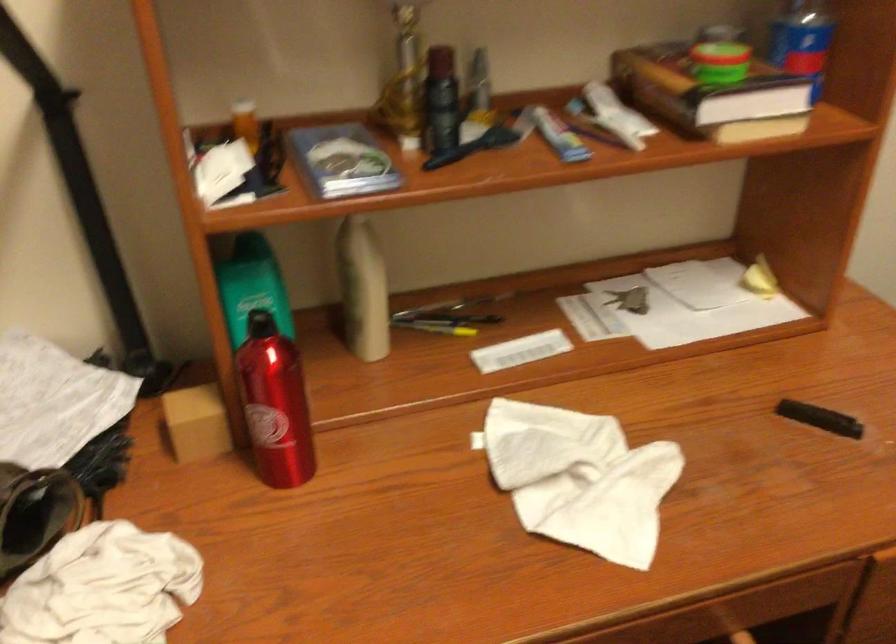
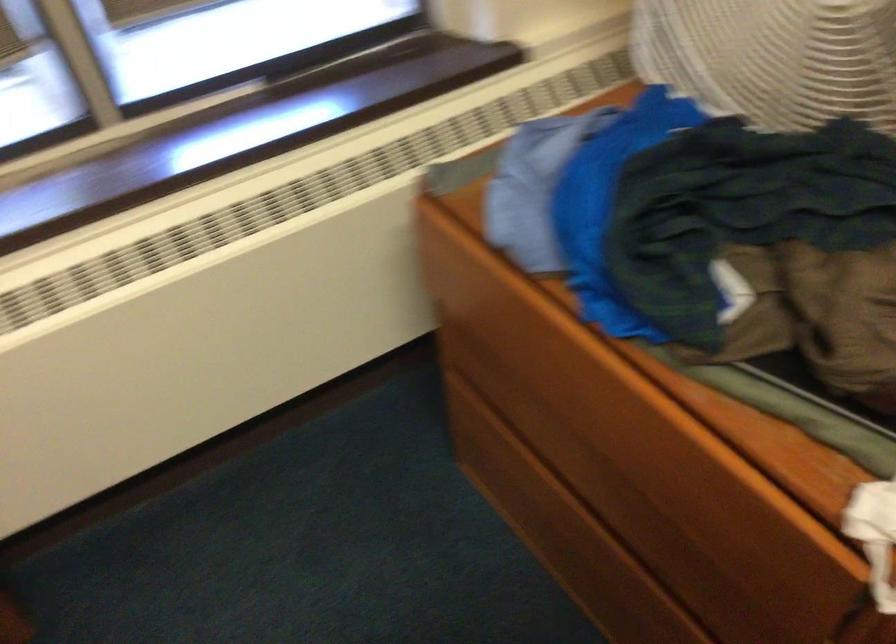
First-person continuous shooting, in which direction is the camera rotating?

The rotation direction of the camera is left-down.